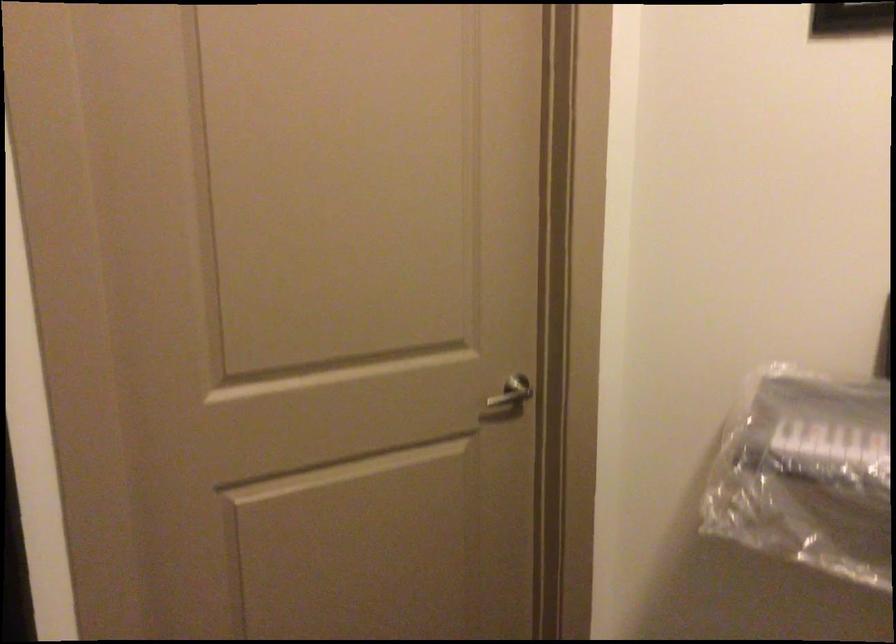
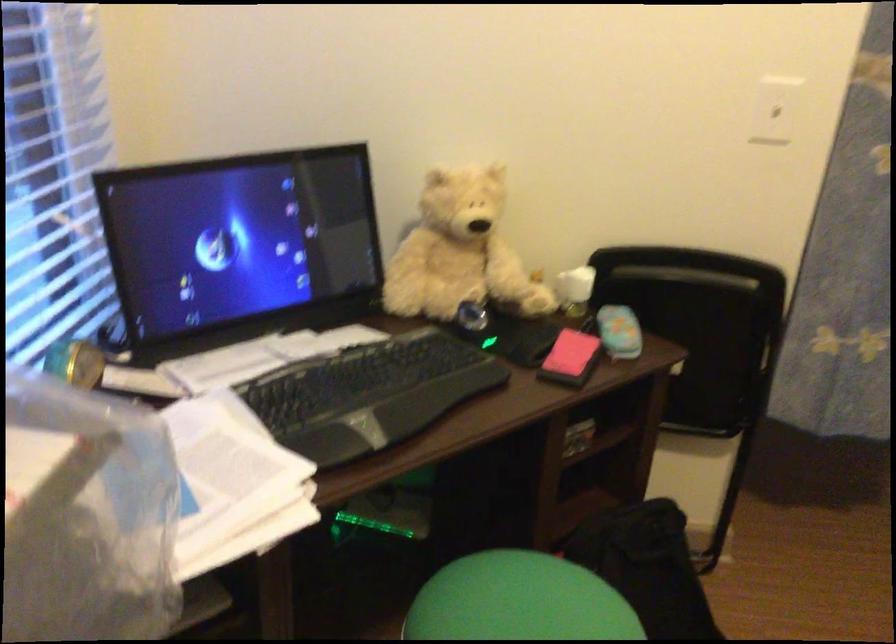
First-person continuous shooting, in which direction is the camera rotating?

The camera rotated toward right-down.